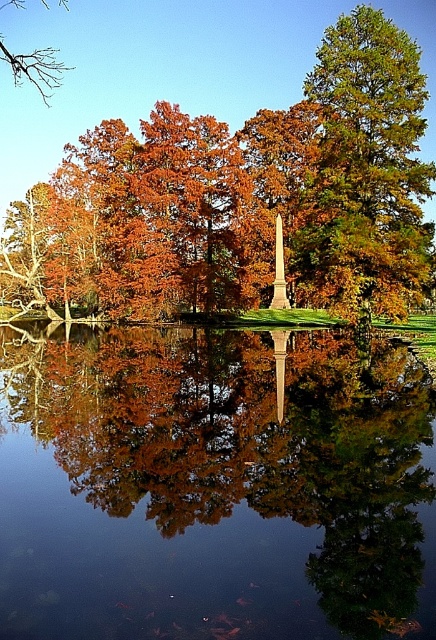
You are an artist planning to paint this autumn scene. You want to ensure the transparent glass lake at center and the green glossy tree at upper right are proportionally accurate. Which object should you draw first to maintain the correct size relationship?

You should draw the green glossy tree at upper right first since it is taller than the transparent glass lake at center, ensuring the lake is depicted as shorter in your painting.

You are standing on the shore of the transparent glass lake at center and want to reach the polished stone obelisk at center. Which direction should you walk to get there?

You should walk to the right because the transparent glass lake at center is to the left of the polished stone obelisk at center, so moving right will bring you closer to the obelisk.